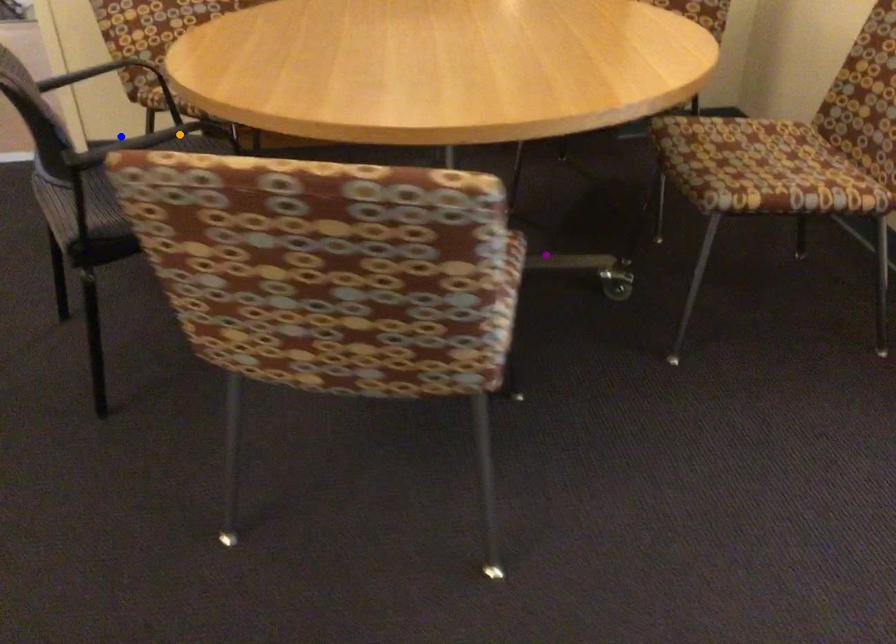
Order these from nearest to farthest:
purple point, orange point, blue point

blue point → orange point → purple point